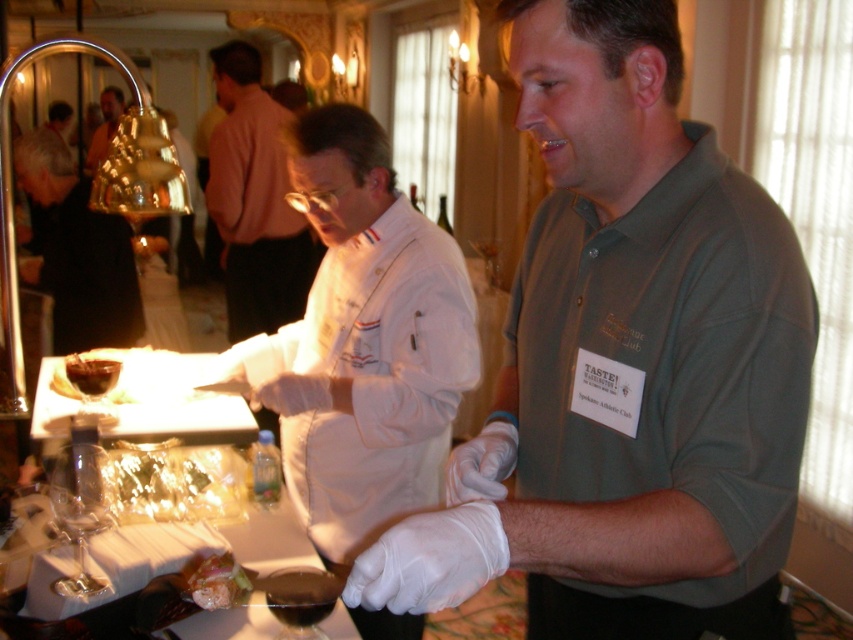
Question: Can you confirm if green cotton shirt at center is positioned to the left of transparent glass wine glass at lower center?

Choices:
 (A) no
 (B) yes

Answer: (A)

Question: Based on their relative distances, which object is nearer to the clear glass wine glass at lower left?

Choices:
 (A) matte gold bell at upper left
 (B) transparent glass wine glass at lower center
 (C) shiny green leafy vegetable at lower center
 (D) transparent glass wine glass at lower left

Answer: (D)

Question: Considering the real-world distances, which object is farthest from the shiny green leafy vegetable at lower center?

Choices:
 (A) dark liquid glass at lower center
 (B) white fabric chef coat at center
 (C) matte gold bell at upper left

Answer: (C)

Question: Is shiny green leafy vegetable at lower center closer to the viewer compared to matte gold bell at upper left?

Choices:
 (A) yes
 (B) no

Answer: (A)

Question: Does green cotton shirt at center have a larger size compared to dark liquid glass at lower center?

Choices:
 (A) no
 (B) yes

Answer: (B)

Question: Among these points, which one is nearest to the camera?

Choices:
 (A) (114, 92)
 (B) (73, 451)
 (C) (310, 616)
 (D) (42, 173)

Answer: (C)